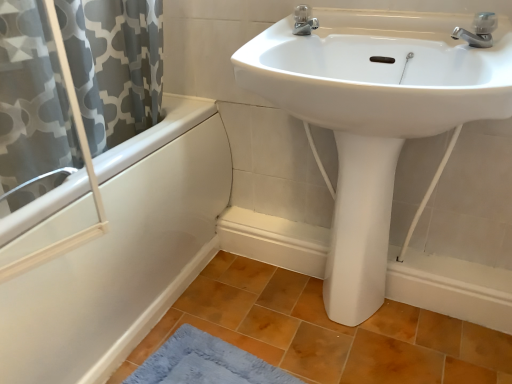
Where is `brown matte tile at lower center`? brown matte tile at lower center is located at coordinates [x=326, y=331].

Where is `white glossy bathtub at left`? The height and width of the screenshot is (384, 512). white glossy bathtub at left is located at coordinates (123, 253).

The height and width of the screenshot is (384, 512). Find the location of `silver metallic faucet at upper right, which ranks as the 1th tap in front-to-back order`. silver metallic faucet at upper right, which ranks as the 1th tap in front-to-back order is located at coordinates (478, 30).

This screenshot has height=384, width=512. Find the location of `silver metallic faucet at upper center, which appears as the 2th tap when viewed from the right`. silver metallic faucet at upper center, which appears as the 2th tap when viewed from the right is located at coordinates (304, 21).

Locate an element on the screen. blue plush bath mat at lower left is located at coordinates (205, 362).

The height and width of the screenshot is (384, 512). Identify the location of brown matte tile at lower center. (326, 331).

Which of these two, white glossy sink at upper center or silver metallic faucet at upper center, marked as the 1th tap in a left-to-right arrangement, stands shorter?

silver metallic faucet at upper center, marked as the 1th tap in a left-to-right arrangement.

Between white glossy sink at upper center and silver metallic faucet at upper center, which appears as the 2th tap when viewed from the right, which one has smaller size?

silver metallic faucet at upper center, which appears as the 2th tap when viewed from the right, is smaller.

Starting from the white glossy sink at upper center, which tap is the 2nd one behind? Please provide its 2D coordinates.

[(304, 21)]

Which object is further away from the camera taking this photo, white glossy sink at upper center or silver metallic faucet at upper center, placed as the 2th tap when sorted from front to back?

silver metallic faucet at upper center, placed as the 2th tap when sorted from front to back, is further from the camera.

Who is shorter, brown matte tile at lower center or white glossy bathtub at left?

Standing shorter between the two is brown matte tile at lower center.

Which object is wider, brown matte tile at lower center or white glossy bathtub at left?

Wider between the two is brown matte tile at lower center.

From the image's perspective, is brown matte tile at lower center located beneath white glossy bathtub at left?

Yes, from the image's perspective, brown matte tile at lower center is below white glossy bathtub at left.

Is brown matte tile at lower center closer to camera compared to white glossy bathtub at left?

That is False.

In the scene shown: From a real-world perspective, is blue plush bath mat at lower left beneath white glossy sink at upper center?

Indeed, from a real-world perspective, blue plush bath mat at lower left is positioned beneath white glossy sink at upper center.

Is the depth of blue plush bath mat at lower left less than that of white glossy sink at upper center?

No, the depth of blue plush bath mat at lower left is greater than that of white glossy sink at upper center.

Is blue plush bath mat at lower left aimed at white glossy sink at upper center?

No.

How many degrees apart are the facing directions of blue plush bath mat at lower left and white glossy sink at upper center?

blue plush bath mat at lower left and white glossy sink at upper center are facing 86.5 degrees away from each other.

Between white glossy sink at upper center and white glossy pedestal at center, which one is positioned in front?

white glossy sink at upper center is closer to the camera.

Is white glossy sink at upper center not within white glossy pedestal at center?

That's correct, white glossy sink at upper center is outside of white glossy pedestal at center.

In the scene shown: Between white glossy sink at upper center and white glossy pedestal at center, which one appears on the right side from the viewer's perspective?

white glossy pedestal at center.

At what (x,y) coordinates should I click in order to perform the action: click on tile above the blue plush bath mat at lower left (from the image's perspective). Please return your answer as a coordinate pair (x, y). The height and width of the screenshot is (384, 512). Looking at the image, I should click on (326, 331).

Is the surface of blue plush bath mat at lower left in direct contact with brown matte tile at lower center?

There is a gap between blue plush bath mat at lower left and brown matte tile at lower center.

Considering the sizes of blue plush bath mat at lower left and brown matte tile at lower center in the image, is blue plush bath mat at lower left wider or thinner than brown matte tile at lower center?

Clearly, blue plush bath mat at lower left has less width compared to brown matte tile at lower center.

From the picture: Is blue plush bath mat at lower left facing away from brown matte tile at lower center?

That's right, blue plush bath mat at lower left is facing away from brown matte tile at lower center.

From a real-world perspective, does white glossy pedestal at center sit lower than blue plush bath mat at lower left?

No.

Is white glossy pedestal at center inside or outside of blue plush bath mat at lower left?

white glossy pedestal at center is outside blue plush bath mat at lower left.

Is the depth of white glossy pedestal at center less than that of blue plush bath mat at lower left?

No, white glossy pedestal at center is behind blue plush bath mat at lower left.

Considering the relative sizes of white glossy pedestal at center and blue plush bath mat at lower left in the image provided, is white glossy pedestal at center wider than blue plush bath mat at lower left?

No, white glossy pedestal at center is not wider than blue plush bath mat at lower left.

Considering the positions of objects silver metallic faucet at upper right, placed as the 2th tap when sorted from back to front, and white glossy bathtub at left in the image provided, who is more to the left, silver metallic faucet at upper right, placed as the 2th tap when sorted from back to front, or white glossy bathtub at left?

white glossy bathtub at left is more to the left.

Does silver metallic faucet at upper right, which is counted as the first tap, starting from the right, have a smaller size compared to white glossy bathtub at left?

Correct, silver metallic faucet at upper right, which is counted as the first tap, starting from the right, occupies less space than white glossy bathtub at left.

Is silver metallic faucet at upper right, placed as the 2th tap when sorted from back to front, next to white glossy bathtub at left and touching it?

No, silver metallic faucet at upper right, placed as the 2th tap when sorted from back to front, is not making contact with white glossy bathtub at left.

Is silver metallic faucet at upper right, arranged as the 2th tap when viewed from the left, not inside white glossy bathtub at left?

That's correct, silver metallic faucet at upper right, arranged as the 2th tap when viewed from the left, is outside of white glossy bathtub at left.

From a real-world perspective, which tap is the 2nd one above the white glossy sink at upper center? Please provide its 2D coordinates.

[(304, 21)]

The image size is (512, 384). Identify the location of tile that appears below the white glossy bathtub at left (from a real-world perspective). (326, 331).

Based on their spatial positions, is white glossy sink at upper center or white glossy bathtub at left closer to blue plush bath mat at lower left?

white glossy bathtub at left is positioned closer to the anchor blue plush bath mat at lower left.

Considering their positions, is brown matte tile at lower center positioned closer to silver metallic faucet at upper center, marked as the 1th tap in a left-to-right arrangement, than white glossy pedestal at center?

white glossy pedestal at center is closer to silver metallic faucet at upper center, marked as the 1th tap in a left-to-right arrangement.

Which object lies nearer to the anchor point white glossy sink at upper center, silver metallic faucet at upper right, arranged as the 2th tap when viewed from the left, or white glossy bathtub at left?

silver metallic faucet at upper right, arranged as the 2th tap when viewed from the left, is positioned closer to the anchor white glossy sink at upper center.

From the image, which object appears to be farther from silver metallic faucet at upper right, arranged as the 2th tap when viewed from the left, white glossy pedestal at center or silver metallic faucet at upper center, marked as the 1th tap in a left-to-right arrangement?

white glossy pedestal at center.

Looking at the image, which one is located further to blue plush bath mat at lower left, white glossy pedestal at center or white glossy bathtub at left?

white glossy pedestal at center is further to blue plush bath mat at lower left.

From the picture: When comparing their distances from white glossy bathtub at left, does blue plush bath mat at lower left or silver metallic faucet at upper center, the 1th tap when ordered from back to front, seem further?

silver metallic faucet at upper center, the 1th tap when ordered from back to front.

From the image, which object appears to be nearer to blue plush bath mat at lower left, white glossy bathtub at left or white glossy sink at upper center?

The object closer to blue plush bath mat at lower left is white glossy bathtub at left.

Consider the image. Estimate the real-world distances between objects in this image. Which object is further from white glossy sink at upper center, silver metallic faucet at upper center, placed as the 2th tap when sorted from front to back, or blue plush bath mat at lower left?

blue plush bath mat at lower left lies further to white glossy sink at upper center than the other object.

Image resolution: width=512 pixels, height=384 pixels. Identify the location of tap between silver metallic faucet at upper center, placed as the 2th tap when sorted from front to back, and white glossy pedestal at center from top to bottom. (478, 30).

This screenshot has height=384, width=512. What are the coordinates of `tile between white glossy bathtub at left and white glossy pedestal at center` in the screenshot? It's located at (326, 331).

Find the location of a particular element. The width and height of the screenshot is (512, 384). tap between silver metallic faucet at upper center, which appears as the 2th tap when viewed from the right, and blue plush bath mat at lower left from top to bottom is located at coordinates (478, 30).

This screenshot has height=384, width=512. Find the location of `sink between silver metallic faucet at upper right, arranged as the 2th tap when viewed from the left, and brown matte tile at lower center, in the vertical direction`. sink between silver metallic faucet at upper right, arranged as the 2th tap when viewed from the left, and brown matte tile at lower center, in the vertical direction is located at coordinates (380, 72).